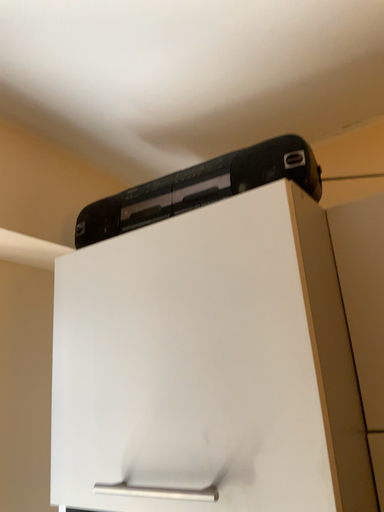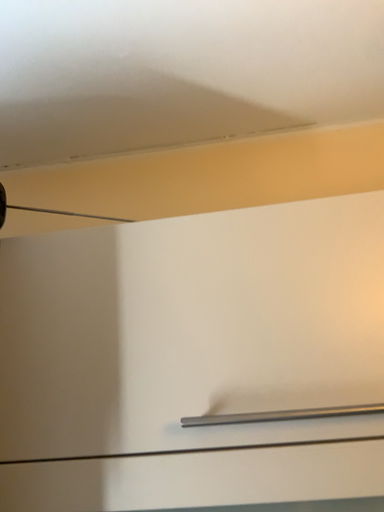
Question: How did the camera likely rotate when shooting the video?

Choices:
 (A) rotated right
 (B) rotated left

Answer: (A)